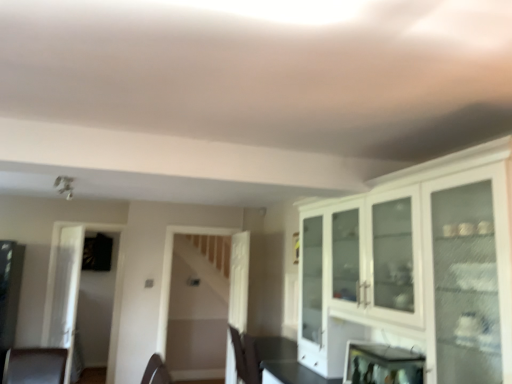
Question: Does metallic reflective mirror at lower right have a lesser width compared to white glossy cabinet at upper right?

Choices:
 (A) yes
 (B) no

Answer: (A)

Question: Is metallic reflective mirror at lower right far from white glossy cabinet at upper right?

Choices:
 (A) no
 (B) yes

Answer: (A)

Question: Considering the relative positions of metallic reflective mirror at lower right and white glossy cabinet at upper right in the image provided, is metallic reflective mirror at lower right behind white glossy cabinet at upper right?

Choices:
 (A) yes
 (B) no

Answer: (A)

Question: From the image's perspective, is metallic reflective mirror at lower right on top of white glossy cabinet at upper right?

Choices:
 (A) no
 (B) yes

Answer: (A)

Question: From a real-world perspective, does metallic reflective mirror at lower right sit lower than white glossy cabinet at upper right?

Choices:
 (A) yes
 (B) no

Answer: (A)

Question: Relative to white glossy cabinet at upper right, is transparent glass door at left in front or behind?

Choices:
 (A) behind
 (B) front

Answer: (A)

Question: Choose the correct answer: Is transparent glass door at left inside white glossy cabinet at upper right or outside it?

Choices:
 (A) inside
 (B) outside

Answer: (B)

Question: Considering the positions of transparent glass door at left and white glossy cabinet at upper right in the image, is transparent glass door at left wider or thinner than white glossy cabinet at upper right?

Choices:
 (A) thin
 (B) wide

Answer: (A)

Question: Is transparent glass door at left taller or shorter than white glossy cabinet at upper right?

Choices:
 (A) tall
 (B) short

Answer: (A)

Question: Is metallic reflective mirror at lower right inside the boundaries of white glossy cabinet at upper right, or outside?

Choices:
 (A) outside
 (B) inside

Answer: (B)

Question: From the image's perspective, is metallic reflective mirror at lower right located above or below white glossy cabinet at upper right?

Choices:
 (A) below
 (B) above

Answer: (A)

Question: Considering their positions, is metallic reflective mirror at lower right located in front of or behind white glossy cabinet at upper right?

Choices:
 (A) front
 (B) behind

Answer: (B)

Question: Looking at their shapes, would you say metallic reflective mirror at lower right is wider or thinner than white glossy cabinet at upper right?

Choices:
 (A) wide
 (B) thin

Answer: (B)

Question: Considering the positions of white glossy cabinet at upper right and transparent glass door at left in the image, is white glossy cabinet at upper right wider or thinner than transparent glass door at left?

Choices:
 (A) thin
 (B) wide

Answer: (B)

Question: Is white glossy cabinet at upper right inside or outside of transparent glass door at left?

Choices:
 (A) outside
 (B) inside

Answer: (A)